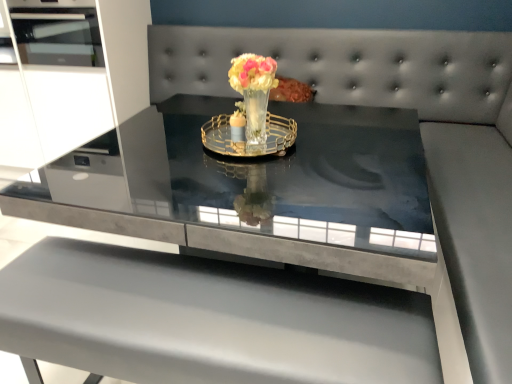
Where is `free location to the left of gold metallic tray at center`? free location to the left of gold metallic tray at center is located at coordinates (155, 150).